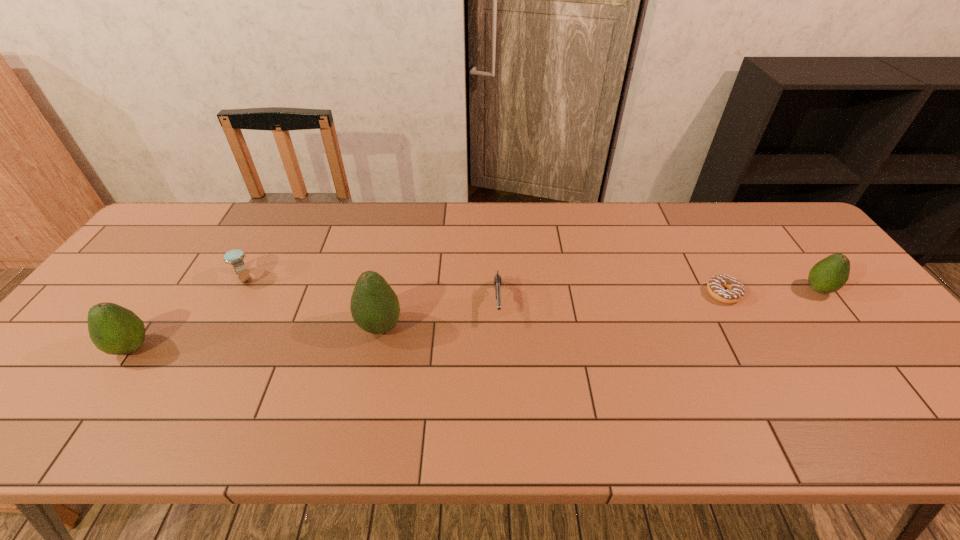
At what (x,y) coordinates should I click in order to perform the action: click on the leftmost object. Please return your answer as a coordinate pair (x, y). This screenshot has width=960, height=540. Looking at the image, I should click on (115, 330).

You are a GUI agent. You are given a task and a screenshot of the screen. Output one action in this format:
    pyautogui.click(x=<x>, y=<y>)
    Task: Click on the leftmost avocado
    
    Given the screenshot: What is the action you would take?
    pyautogui.click(x=115, y=330)

You are a GUI agent. You are given a task and a screenshot of the screen. Output one action in this format:
    pyautogui.click(x=<x>, y=<y>)
    Task: Click on the second avocado from right to left
    The width and height of the screenshot is (960, 540).
    Given the screenshot: What is the action you would take?
    pyautogui.click(x=374, y=306)

You are a GUI agent. You are given a task and a screenshot of the screen. Output one action in this format:
    pyautogui.click(x=<x>, y=<y>)
    Task: Click on the third tallest object
    This screenshot has height=540, width=960.
    Given the screenshot: What is the action you would take?
    pyautogui.click(x=830, y=274)

Where is `the rightmost object`? This screenshot has width=960, height=540. the rightmost object is located at coordinates (830, 274).

Identify the location of the fourth tallest object. Image resolution: width=960 pixels, height=540 pixels. (235, 257).

Where is `the second object from left to right`? The height and width of the screenshot is (540, 960). the second object from left to right is located at coordinates (235, 257).

Find the location of a particular element. gun is located at coordinates (497, 279).

Identify the location of the second shortest object. Image resolution: width=960 pixels, height=540 pixels. 497,279.

Identify the location of the second object from right to left. This screenshot has width=960, height=540. (735, 291).